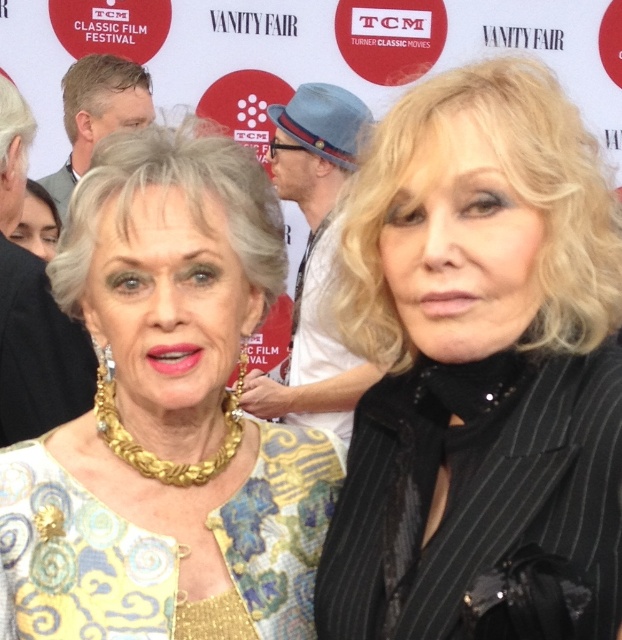
You are a photographer at the TCM Classic Film Festival. You need to take a photo of the black pinstripe suit at right and the gold chain necklace at center. The minimum distance required for your camera to focus properly is 10 feet. Can you take the photo without moving either subject?

The black pinstripe suit at right is 9.95 feet away from the gold chain necklace at center. Since the minimum focus distance is 10 feet, the camera cannot focus properly. Therefore, you need to move one of the subjects farther apart to achieve the required distance.

You are a photographer at the TCM Classic Film Festival. You need to capture a closeup shot of the gray hair at upper left and the blue felt hat at center. Given their sizes, which object will appear bigger in the photo?

The blue felt hat at center will appear bigger in the photo because it has a larger size compared to the gray hair at upper left.

You are a photographer at the TCM Classic Film Festival. You need to capture a photo of both the black pinstripe suit at right and the blue felt hat at center. Can you frame them in the same shot without moving either object? Explain why or why not based on their positions.

The black pinstripe suit at right is positioned under the blue felt hat at center, so yes, they can be framed in the same shot since the blue felt hat at center is above the black pinstripe suit at right.